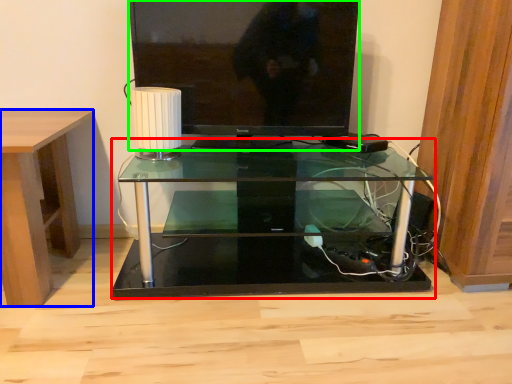
Question: Which object is positioned farthest from table (highlighted by a red box)? Select from desk (highlighted by a blue box) and television (highlighted by a green box).

Choices:
 (A) desk
 (B) television

Answer: (A)